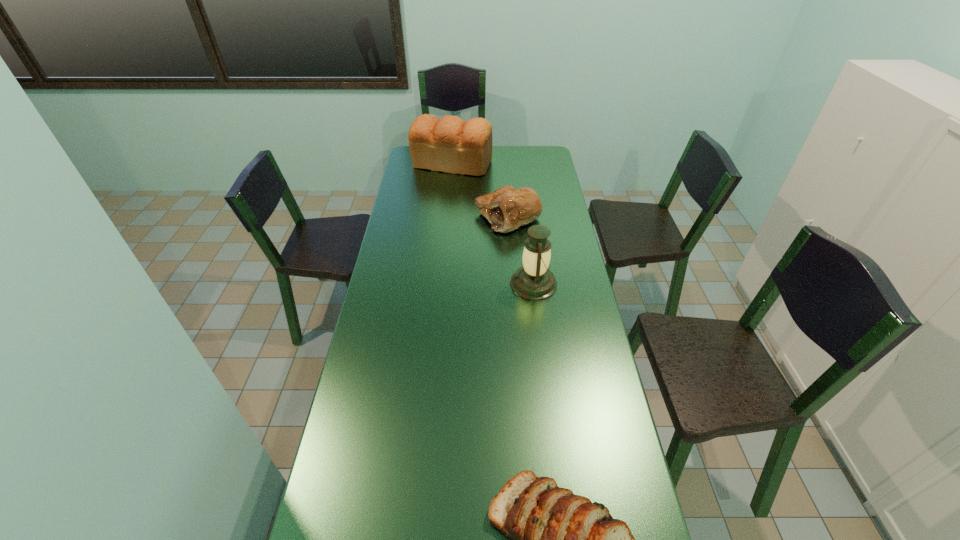
The image size is (960, 540). In order to click on free region located 0.050m on the filling side of the second farthest object in this screenshot , I will do `click(464, 217)`.

Where is `free spot located on the filling side of the second farthest object`? The width and height of the screenshot is (960, 540). free spot located on the filling side of the second farthest object is located at coordinates [431, 217].

Identify the location of object located in the far edge section of the desktop. The height and width of the screenshot is (540, 960). (450, 144).

The height and width of the screenshot is (540, 960). In order to click on object positioned at the left edge in this screenshot , I will do `click(450, 144)`.

Where is `lantern located in the right edge section of the desktop`? The image size is (960, 540). lantern located in the right edge section of the desktop is located at coordinates (534, 281).

What are the coordinates of `bread that is positioned at the right edge` in the screenshot? It's located at (507, 208).

What are the coordinates of `object present at the far left corner` in the screenshot? It's located at (450, 144).

You are a GUI agent. You are given a task and a screenshot of the screen. Output one action in this format:
    pyautogui.click(x=<x>, y=<y>)
    Task: Click on the free space at the left edge of the desktop
    The width and height of the screenshot is (960, 540).
    Given the screenshot: What is the action you would take?
    pyautogui.click(x=408, y=220)

The height and width of the screenshot is (540, 960). Identify the location of vacant space at the right edge of the desktop. (587, 488).

Where is `unoccupied area between the second nearest bread and the lantern`? The height and width of the screenshot is (540, 960). unoccupied area between the second nearest bread and the lantern is located at coordinates (520, 250).